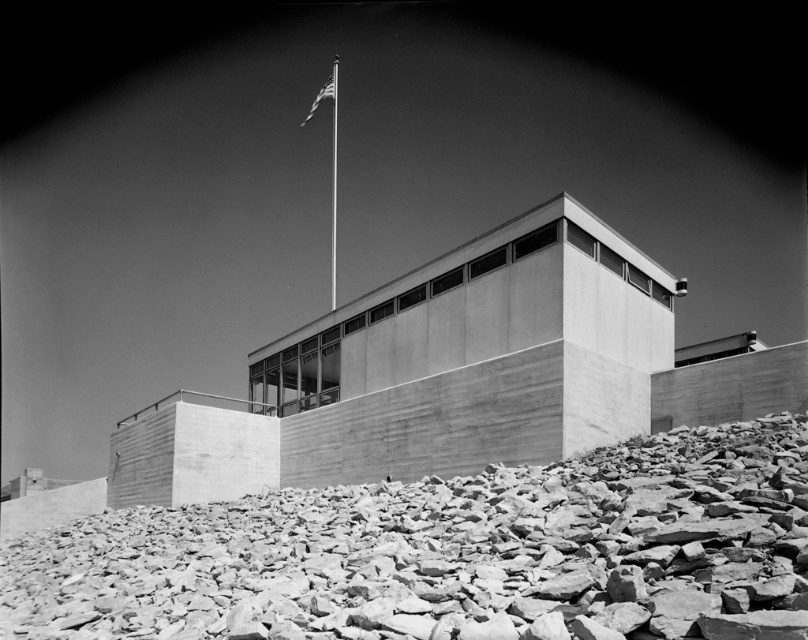
You are standing at the base of the modernist building and want to place a small potted plant exactly where the smooth gray rocks at bottom are located. According to the coordinates provided, what are the coordinates where you should place the plant?

The coordinates for the smooth gray rocks at bottom are at point (451,554), so you should place the plant there.

You are a photographer planning to capture the metallic flag pole at upper center and the american flag at upper center in a single shot. Since the flag is fluttering, you need to ensure both objects are in focus. Given that the flag is above the flag pole, how should you adjust your camera settings to ensure both are sharp?

The metallic flag pole at upper center is located below the american flag at upper center. To ensure both are in focus, adjust your camera to a smaller aperture for greater depth of field, focusing on a point between the two objects.

You are a photographer planning to capture the metallic flag pole at upper center and the smooth gray rocks at bottom in the same frame. Based on their sizes in the image, which object would appear larger in your photo?

The metallic flag pole at upper center would appear larger in the photo because it is larger in size compared to the smooth gray rocks at bottom.